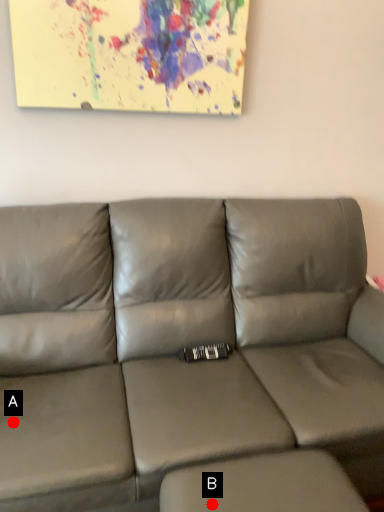
Question: Two points are circled on the image, labeled by A and B beside each circle. Which point appears farthest from the camera in this image?

Choices:
 (A) A is further
 (B) B is further

Answer: (A)